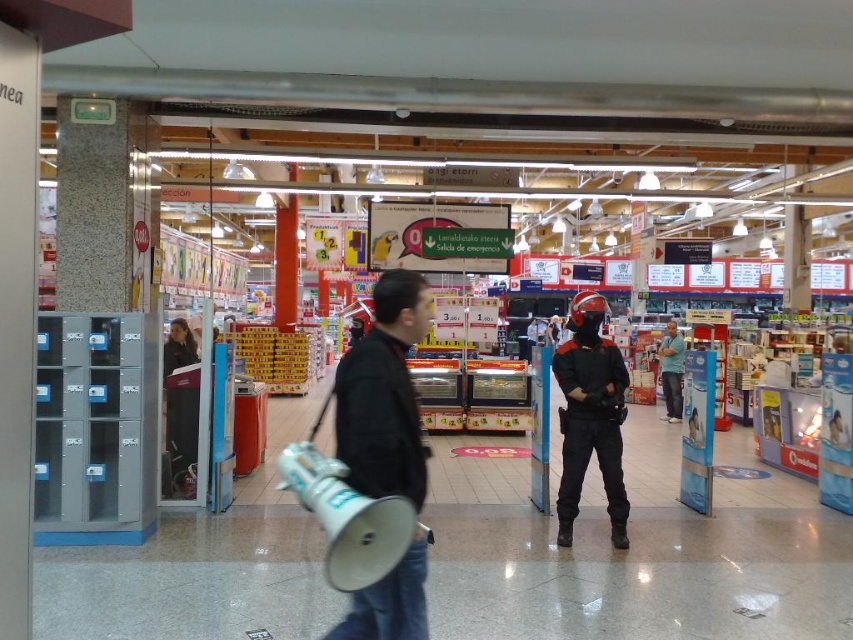
You are standing in the retail store and want to determine which of the two points, point (628,506) or point (664,360), is nearer to you. Based on the scene, which point is closer?

Point (628,506) is closer to the camera than point (664,360), so it is the nearer point.

You are standing at the entrance of the supermarket and see two points marked in the image. The first point is at coordinate point [399,289] and the second is at point [670,333]. Which point is closer to you?

Point [399,289] is in front of point [670,333], so it is closer to you.

You are a customer in the store and want to ask the person in the black matte uniform at center about a product located near the blue fabric shirt at center. Can you comfortably walk between them to reach the product?

The black matte uniform at center and blue fabric shirt at center are 6.67 meters apart, so yes, you can comfortably walk between them to reach the product since the distance is sufficient for movement.